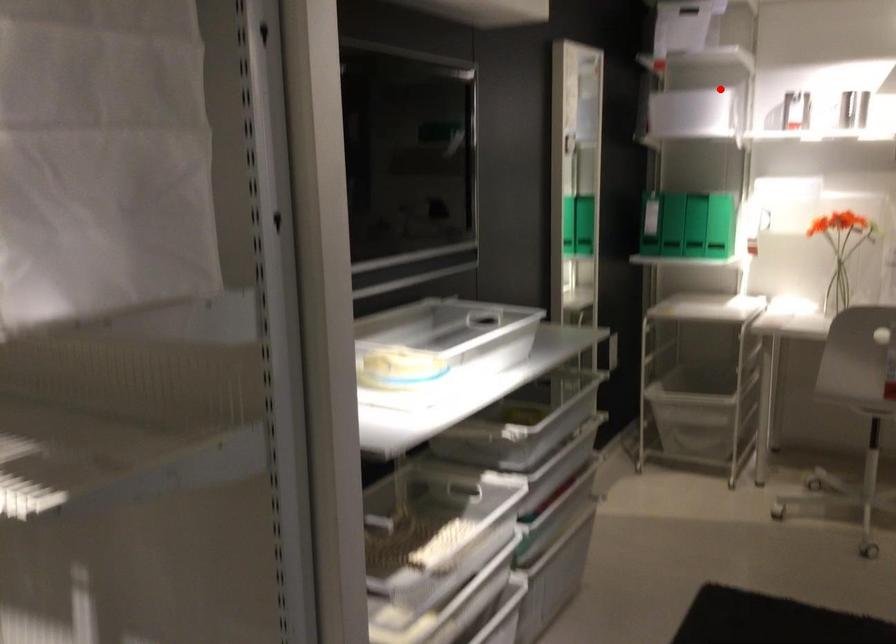
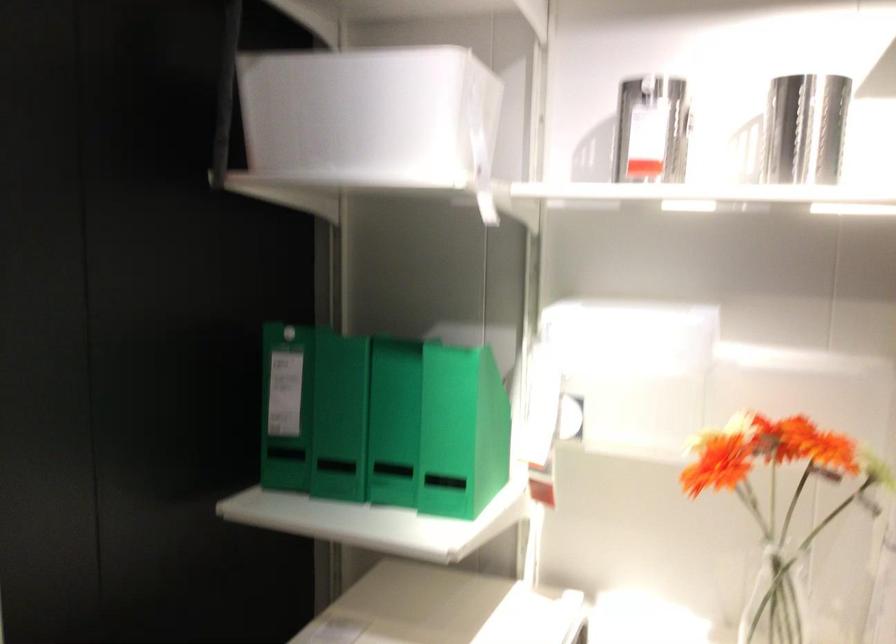
Where in the second image is the point corresponding to the highlighted location from the first image?

(373, 118)